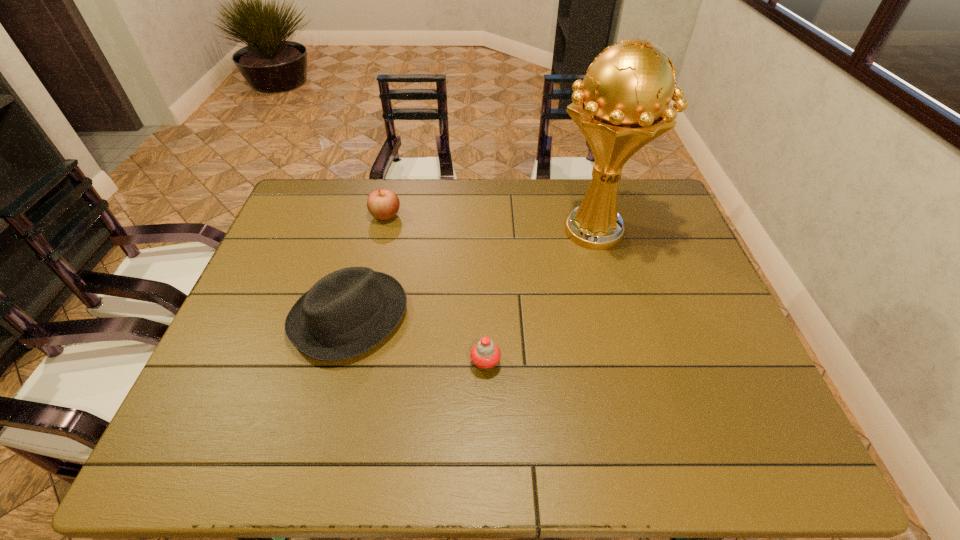
This screenshot has height=540, width=960. I want to click on trophy_cup, so click(x=623, y=103).

At what (x,y) coordinates should I click in order to perform the action: click on the rightmost object. Please return your answer as a coordinate pair (x, y). The image size is (960, 540). Looking at the image, I should click on (623, 103).

The width and height of the screenshot is (960, 540). In order to click on the second tallest object in this screenshot , I will do `click(347, 312)`.

Where is `apple`? The image size is (960, 540). apple is located at coordinates (383, 204).

Where is `cupcake`? This screenshot has height=540, width=960. cupcake is located at coordinates (485, 354).

Identify the location of free space located 0.260m at the front of the trophy_cup where the globe is prominent. This screenshot has width=960, height=540. (623, 334).

This screenshot has height=540, width=960. I want to click on vacant space located 0.050m on the front of the fedora, so click(331, 385).

This screenshot has height=540, width=960. In order to click on free space located on the right of the apple in this screenshot , I will do `click(456, 216)`.

Locate an element on the screen. Image resolution: width=960 pixels, height=540 pixels. vacant space situated 0.120m on the right of the third object from left to right is located at coordinates (550, 363).

The height and width of the screenshot is (540, 960). I want to click on trophy_cup at the far edge, so tap(623, 103).